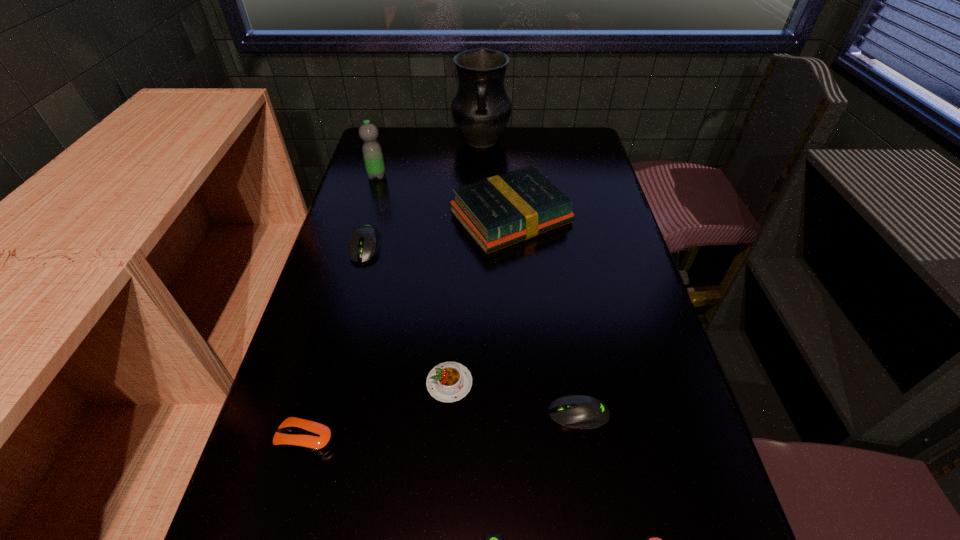
Find the location of a particular element. This screenshot has width=960, height=540. vacant space located 0.340m on the back of the pudding is located at coordinates (456, 256).

Where is `vacant space situated on the back of the bigger orange computer mouse`? The width and height of the screenshot is (960, 540). vacant space situated on the back of the bigger orange computer mouse is located at coordinates (339, 323).

Locate an element on the screen. object at the far edge is located at coordinates (481, 109).

Locate an element on the screen. The width and height of the screenshot is (960, 540). water bottle present at the left edge is located at coordinates (368, 132).

This screenshot has height=540, width=960. In order to click on hardback book that is at the right edge in this screenshot , I will do `click(499, 211)`.

Find the location of a particular element. computer mouse that is at the right edge is located at coordinates (575, 411).

I want to click on free space at the far edge of the desktop, so click(x=544, y=133).

Find the location of a particular element. The height and width of the screenshot is (540, 960). blank space at the left edge of the desktop is located at coordinates (319, 492).

The width and height of the screenshot is (960, 540). In the image, there is a desktop. What are the coordinates of `blank space at the right edge` in the screenshot? It's located at (658, 463).

Find the location of a particular element. Image resolution: width=960 pixels, height=540 pixels. blank space at the far left corner is located at coordinates (405, 141).